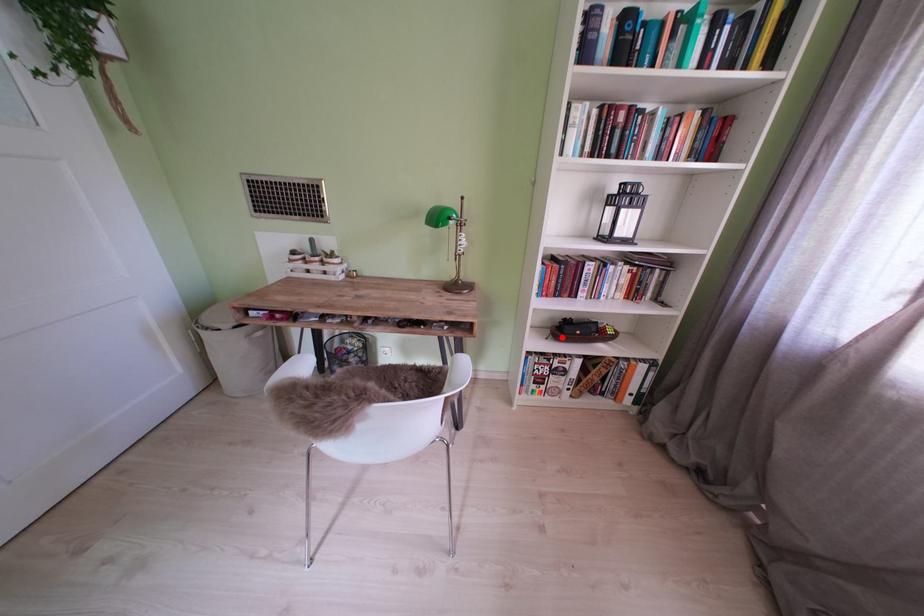
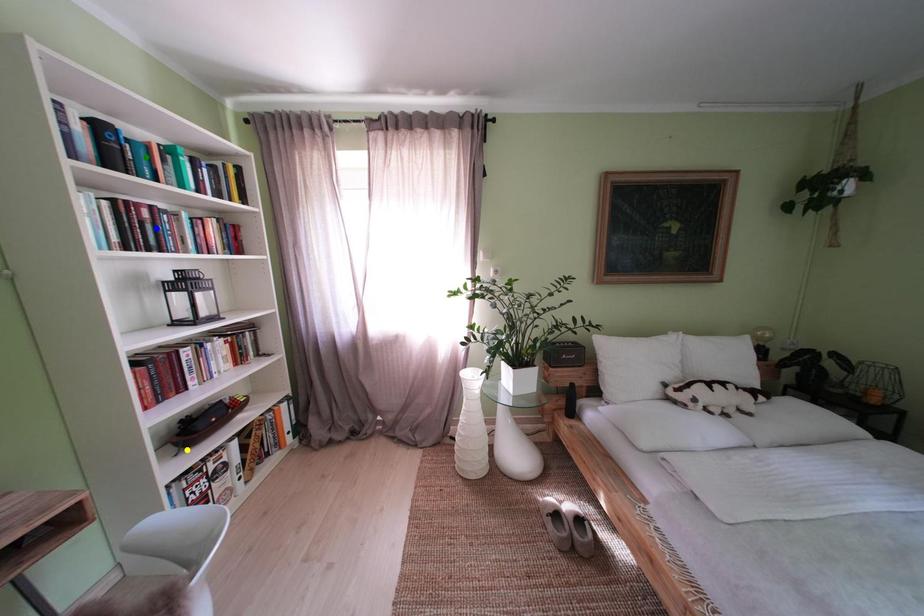
Question: I am providing you with two images of the same scene from different viewpoints. A red point is marked on the first image. You are given multiple points on the second image. Which mark in image 2 goes with the point in image 1?

Choices:
 (A) green point
 (B) yellow point
 (C) blue point

Answer: (B)